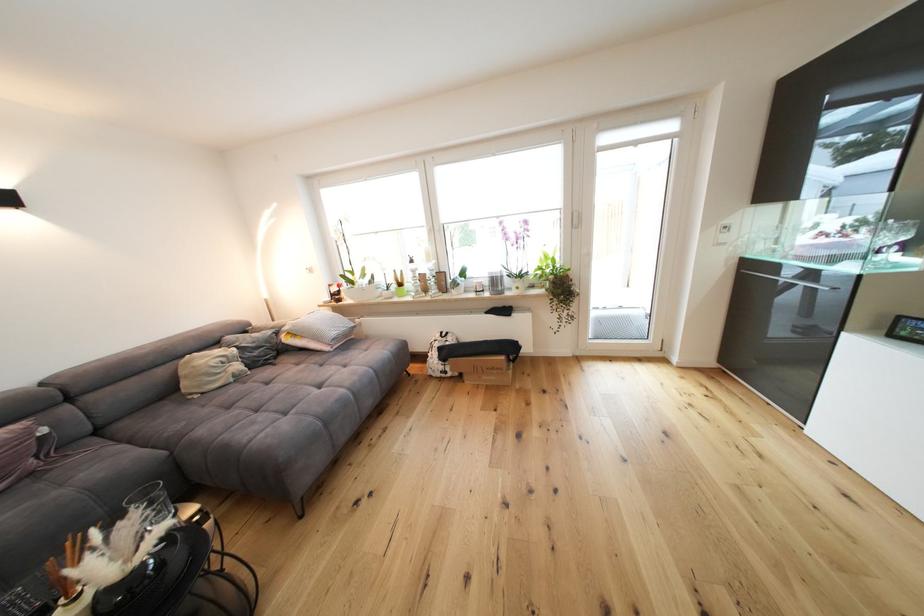
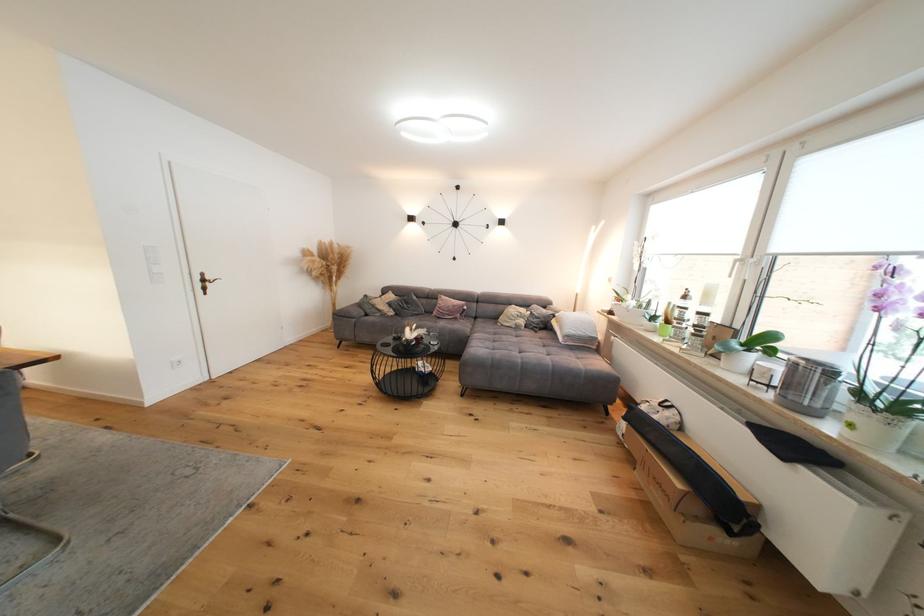
The point at (525, 290) is marked in the first image. Where is the corresponding point in the second image?

(858, 427)